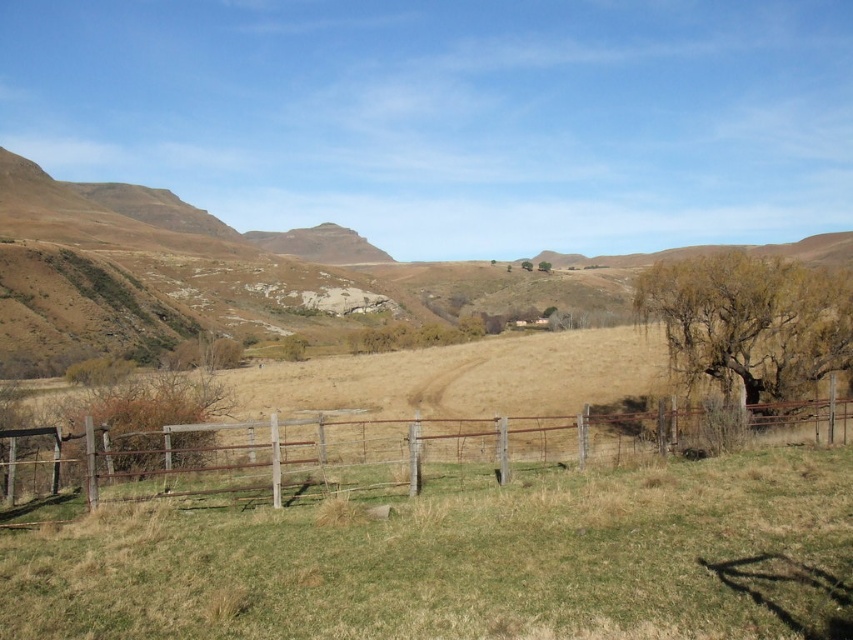
Does green grassy field at center appear on the right side of rusty wood fence at lower center?

Indeed, green grassy field at center is positioned on the right side of rusty wood fence at lower center.

The image size is (853, 640). What do you see at coordinates (465, 561) in the screenshot?
I see `green grassy field at center` at bounding box center [465, 561].

Identify the location of green grassy field at center. (465, 561).